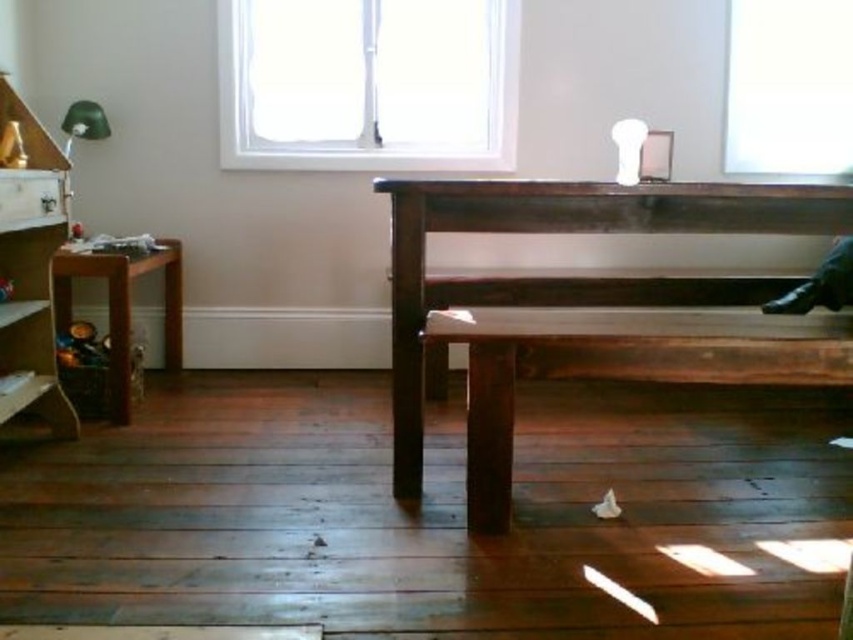
You are standing in the room and want to place a new decorative item at the point marked as point (738, 355). Considering the existing furniture arrangement, how far in feet will this point be from your current position?

The point (738, 355) is 5.81 feet away from the camera, so placing the decorative item there would require it to be 5.81 feet away from your current position.

You are a guest in this room and want to sit down. Which object, the dark brown wooden bench at center or the transparent glass window at upper right, is more suitable for sitting?

The dark brown wooden bench at center is bigger than the transparent glass window at upper right, so it is more suitable for sitting.